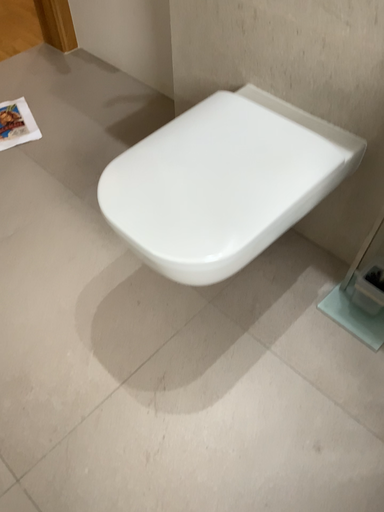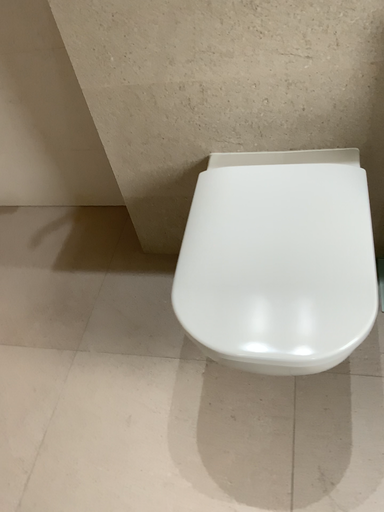
Question: How did the camera likely rotate when shooting the video?

Choices:
 (A) rotated downward
 (B) rotated upward

Answer: (B)